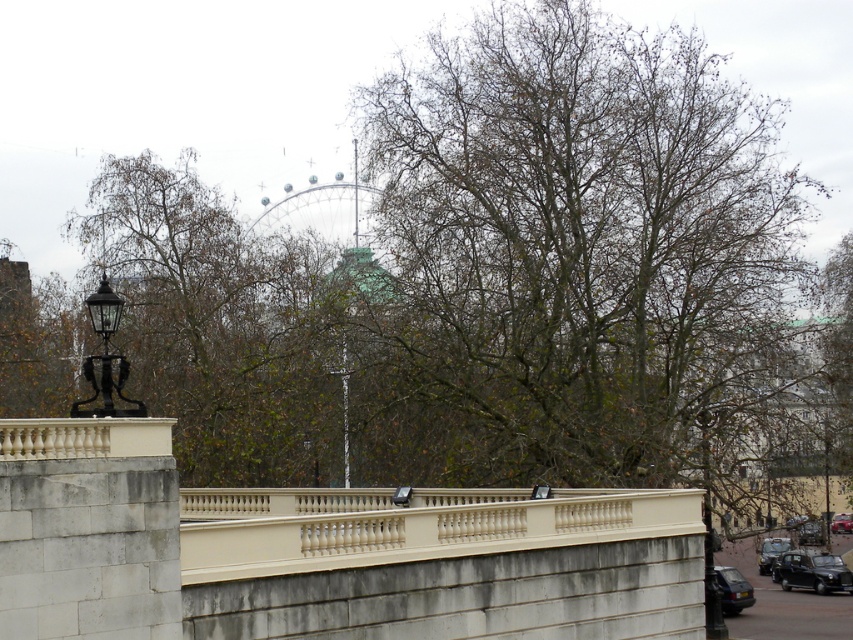
Question: Considering the relative positions of white stone bridge at center and black matte car at lower right in the image provided, where is white stone bridge at center located with respect to black matte car at lower right?

Choices:
 (A) right
 (B) left

Answer: (B)

Question: Where is bare branches at center located in relation to red metallic car at center in the image?

Choices:
 (A) below
 (B) above

Answer: (B)

Question: Based on their relative distances, which object is farther from the dark gray metallic car at lower right?

Choices:
 (A) black matte car at lower right
 (B) black glossy car at lower right
 (C) shiny black car at lower right
 (D) red metallic car at center

Answer: (C)

Question: Which of the following is the farthest from the observer?

Choices:
 (A) dark gray metallic car at lower right
 (B) white stone bridge at center
 (C) shiny black car at lower right
 (D) bare branches at center

Answer: (C)

Question: Among these points, which one is farthest from the camera?

Choices:
 (A) (421, 156)
 (B) (798, 529)
 (C) (740, 573)

Answer: (C)

Question: Considering the relative positions of dark gray metallic car at lower right and black glossy car at lower right in the image provided, where is dark gray metallic car at lower right located with respect to black glossy car at lower right?

Choices:
 (A) below
 (B) above

Answer: (A)